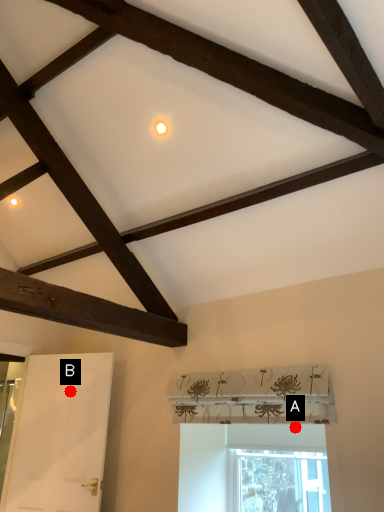
Question: Two points are circled on the image, labeled by A and B beside each circle. Which point appears closest to the camera in this image?

Choices:
 (A) A is closer
 (B) B is closer

Answer: (A)